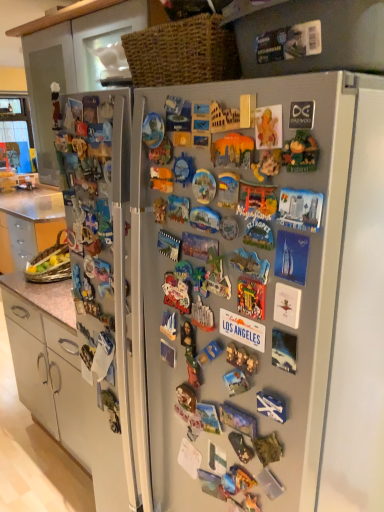
Question: In the image, is matte brown figurine at upper left, which is the tenth toy in right-to-left order, positioned in front of or behind matte plastic magnet at center, the 5th toy viewed from the left?

Choices:
 (A) front
 (B) behind

Answer: (B)

Question: In terms of size, does matte brown figurine at upper left, which is the tenth toy in right-to-left order, appear bigger or smaller than matte plastic magnet at center, the 5th toy viewed from the left?

Choices:
 (A) small
 (B) big

Answer: (B)

Question: Which is nearer to the matte plastic magnet at center, which is the sixth toy in right-to-left order?

Choices:
 (A) matte brown figurine at upper left, the first toy viewed from the left
 (B) satin silver fridge at center
 (C) metallic silver toy at center, which is the fourth toy from left to right
 (D) matte plastic cards at center, the second toy when ordered from left to right
 (E) matte plastic magnet at center, which is the 8th toy in left-to-right order

Answer: (C)

Question: Which is nearer to the multicolored plastic toy at center, the 4th toy in the right-to-left sequence?

Choices:
 (A) white plastic toy at center, positioned as the 3th toy in left-to-right order
 (B) wooden puzzle piece at center, which appears as the second toy when viewed from the right
 (C) matte plastic magnet at center, which is the 8th toy in left-to-right order
 (D) matte plastic cards at center, the second toy when ordered from left to right
 (E) matte brown figurine at upper left, the first toy viewed from the left

Answer: (B)